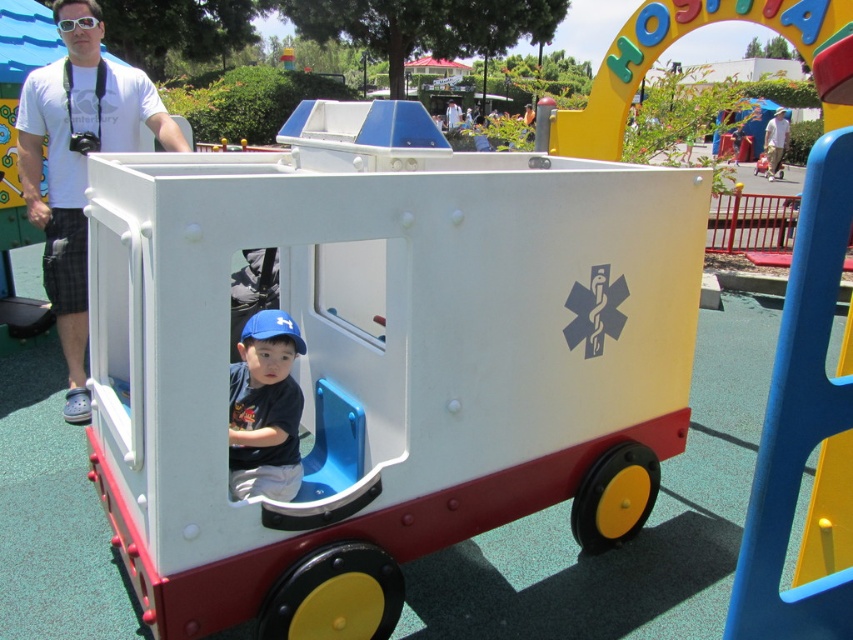
You are a parent at the playground and see your child playing with the white plastic toy car at center and the white matte shirt at upper left. Which object is closer to the ground?

The white plastic toy car at center is located below the white matte shirt at upper left, so it is closer to the ground.